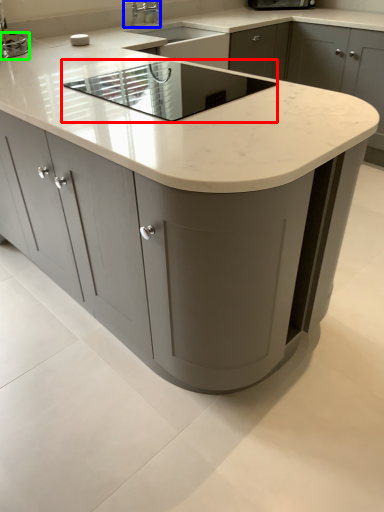
Question: Considering the real-world distances, which object is farthest from appliance (highlighted by a red box)? tap (highlighted by a blue box) or appliance (highlighted by a green box)?

Choices:
 (A) tap
 (B) appliance

Answer: (A)